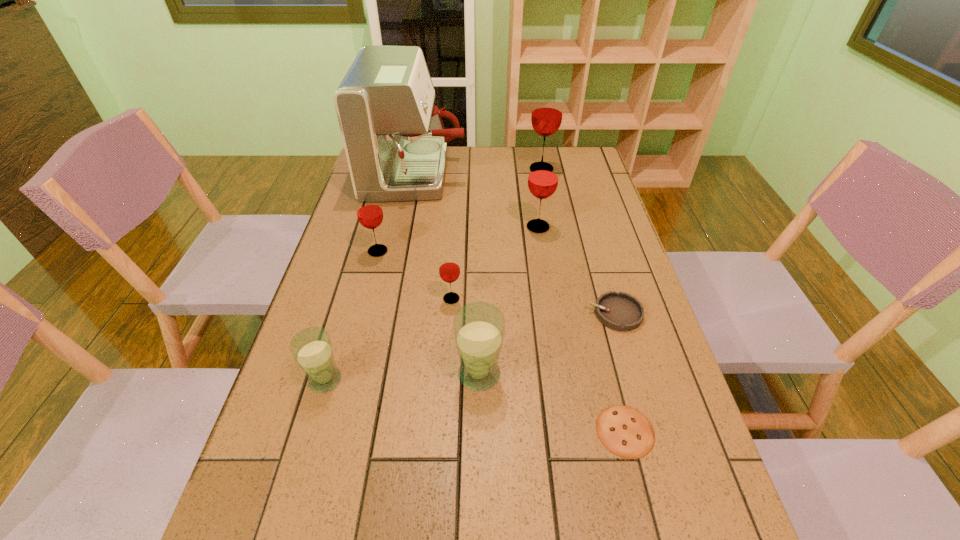
In order to click on red coffee maker in this screenshot , I will do `click(395, 142)`.

Identify the location of coffee maker. (395, 142).

The width and height of the screenshot is (960, 540). I want to click on the farthest glass, so click(547, 112).

The width and height of the screenshot is (960, 540). I want to click on the biggest red glass, so click(x=547, y=112).

You are a GUI agent. You are given a task and a screenshot of the screen. Output one action in this format:
    pyautogui.click(x=<x>, y=<y>)
    Task: Click on the fifth nearest glass
    The image size is (960, 540).
    Given the screenshot: What is the action you would take?
    pyautogui.click(x=543, y=177)

Where is `the seventh shortest object`? This screenshot has width=960, height=540. the seventh shortest object is located at coordinates coord(543,177).

You are a GUI agent. You are given a task and a screenshot of the screen. Output one action in this format:
    pyautogui.click(x=<x>, y=<y>)
    Task: Click on the second smallest red glass
    The height and width of the screenshot is (540, 960).
    Given the screenshot: What is the action you would take?
    pyautogui.click(x=369, y=211)

I want to click on the leftmost red glass, so click(369, 211).

In order to click on the bigger blue glass in this screenshot , I will do `click(479, 329)`.

Locate an element on the screen. This screenshot has width=960, height=540. the smallest red glass is located at coordinates [449, 269].